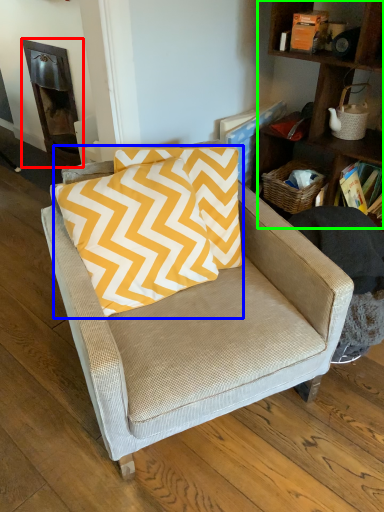
Question: Which is nearer to the fireplace (highlighted by a red box)? pillow (highlighted by a blue box) or shelf (highlighted by a green box).

Choices:
 (A) pillow
 (B) shelf

Answer: (A)